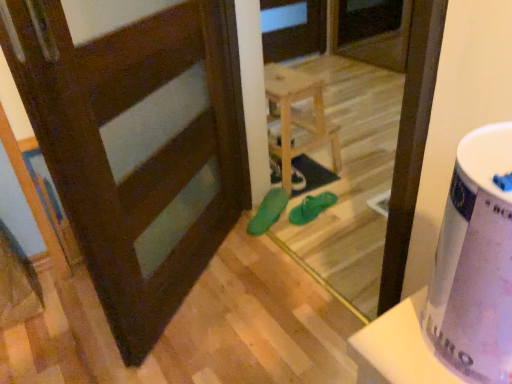
Question: Is matte green shoe at center to the left or to the right of white glossy potty at right in the image?

Choices:
 (A) left
 (B) right

Answer: (A)

Question: In terms of size, does matte green shoe at center appear bigger or smaller than white glossy potty at right?

Choices:
 (A) small
 (B) big

Answer: (A)

Question: Considering the real-world distances, which object is closest to the dark brown wood door at center?

Choices:
 (A) green rubber sandals at center
 (B) white glossy potty at right
 (C) green rubber sandals at center, marked as the second footwear in a right-to-left arrangement
 (D) matte green shoe at center
 (E) light wood stool at center

Answer: (E)

Question: Considering the real-world distances, which object is closest to the white glossy potty at right?

Choices:
 (A) green rubber sandals at center
 (B) matte green shoe at center
 (C) green rubber sandals at center, arranged as the 1th footwear when viewed from the left
 (D) dark brown wood door at center
 (E) green rubber flip-flops at center, which is the first footwear from right to left

Answer: (D)